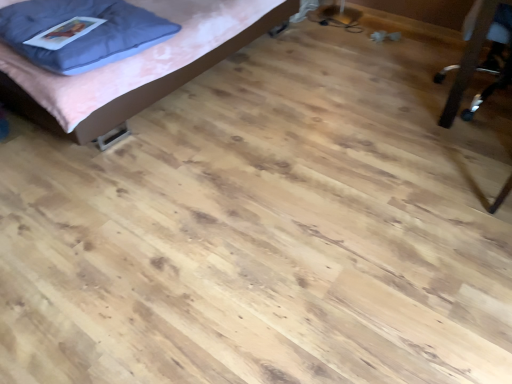
You are a GUI agent. You are given a task and a screenshot of the screen. Output one action in this format:
    pyautogui.click(x=<x>, y=<y>)
    Task: Click on the free point in front of matte pink bed at upper left
    This screenshot has height=384, width=512.
    Given the screenshot: What is the action you would take?
    pyautogui.click(x=214, y=211)